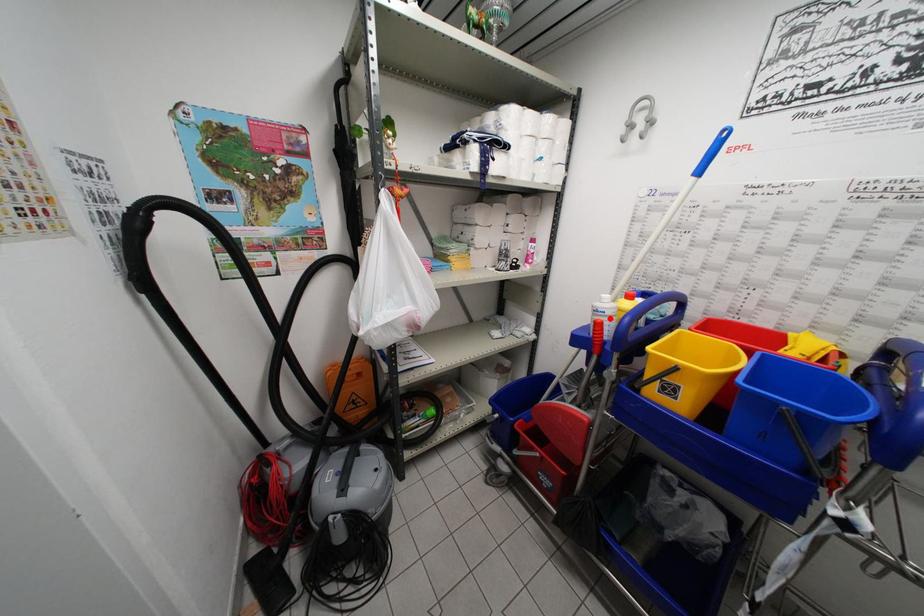
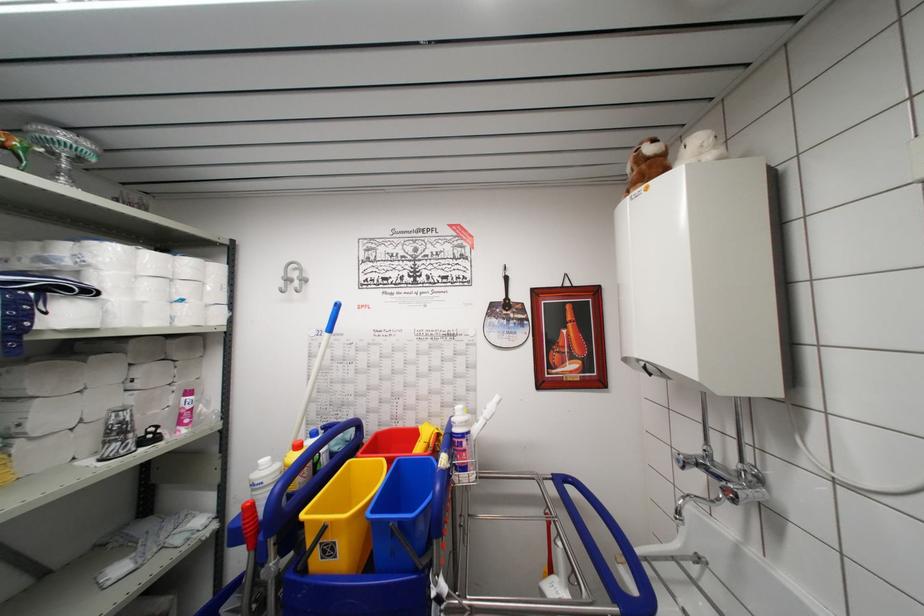
The point at the highlighted location is marked in the first image. Where is the corresponding point in the second image?

(269, 488)